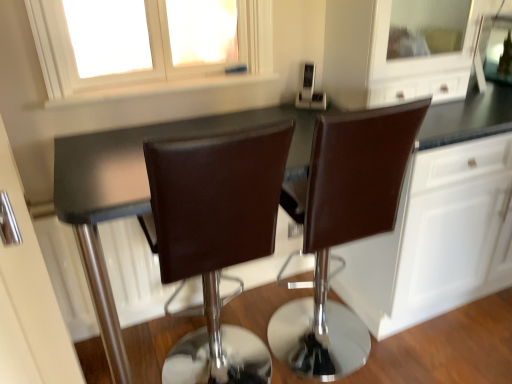
The image size is (512, 384). What do you see at coordinates (433, 239) in the screenshot?
I see `white glossy cabinetry at right` at bounding box center [433, 239].

This screenshot has height=384, width=512. What are the coordinates of `black glossy countertop at center` in the screenshot? It's located at (143, 163).

Image resolution: width=512 pixels, height=384 pixels. Find the location of `white glossy cabinetry at right`. white glossy cabinetry at right is located at coordinates (433, 239).

Who is more distant, brown leather chair at center, which is counted as the first chair, starting from the right, or satin silver toaster at upper center?

satin silver toaster at upper center is further away from the camera.

Is brown leather chair at center, which is counted as the first chair, starting from the right, to the right of satin silver toaster at upper center from the viewer's perspective?

Yes.

Would you say satin silver toaster at upper center is part of brown leather chair at center, which is counted as the first chair, starting from the right,'s contents?

No, satin silver toaster at upper center is located outside of brown leather chair at center, which is counted as the first chair, starting from the right.

Is brown leather chair at center, positioned as the 2th chair in left-to-right order, aimed at satin silver toaster at upper center?

Yes, brown leather chair at center, positioned as the 2th chair in left-to-right order, is facing satin silver toaster at upper center.

Is white matte window at upper center turned away from brown leather chair at center, which is the 1th chair in left-to-right order?

white matte window at upper center does not have its back to brown leather chair at center, which is the 1th chair in left-to-right order.

Considering the relative positions of white matte window at upper center and brown leather chair at center, positioned as the 2th chair in right-to-left order, in the image provided, is white matte window at upper center to the left or to the right of brown leather chair at center, positioned as the 2th chair in right-to-left order,?

white matte window at upper center is to the left of brown leather chair at center, positioned as the 2th chair in right-to-left order.

Considering the points (208, 47) and (183, 204), which point is behind, point (208, 47) or point (183, 204)?

Positioned behind is point (208, 47).

Is white matte window at upper center positioned in front of brown leather chair at center, positioned as the 2th chair in right-to-left order?

No, the depth of white matte window at upper center is greater than that of brown leather chair at center, positioned as the 2th chair in right-to-left order.

Does black glossy countertop at center have a greater width compared to brown leather chair at center, which is the 1th chair in left-to-right order?

Yes, black glossy countertop at center is wider than brown leather chair at center, which is the 1th chair in left-to-right order.

Is black glossy countertop at center turned away from brown leather chair at center, which is the 1th chair in left-to-right order?

Absolutely, black glossy countertop at center is directed away from brown leather chair at center, which is the 1th chair in left-to-right order.

What are the coordinates of `chair below the black glossy countertop at center (from the image's perspective)` in the screenshot? It's located at (216, 237).

From a real-world perspective, which object rests below the other?

black glossy countertop at center.

In the scene shown: In the image, is brown leather chair at center, positioned as the 2th chair in right-to-left order, on the left side or the right side of white glossy cabinetry at right?

Based on their positions, brown leather chair at center, positioned as the 2th chair in right-to-left order, is located to the left of white glossy cabinetry at right.

From a real-world perspective, is brown leather chair at center, positioned as the 2th chair in right-to-left order, positioned above or below white glossy cabinetry at right?

brown leather chair at center, positioned as the 2th chair in right-to-left order, is situated lower than white glossy cabinetry at right in the real world.

Can you confirm if brown leather chair at center, which is the 1th chair in left-to-right order, is shorter than white glossy cabinetry at right?

Yes, brown leather chair at center, which is the 1th chair in left-to-right order, is shorter than white glossy cabinetry at right.

Between black glossy countertop at center and white matte window at upper center, which one has less height?

white matte window at upper center is shorter.

Can you see black glossy countertop at center touching white matte window at upper center?

No, black glossy countertop at center is not with white matte window at upper center.

Is black glossy countertop at center spatially inside white matte window at upper center, or outside of it?

black glossy countertop at center cannot be found inside white matte window at upper center.

Is point (314, 114) less distant than point (70, 54)?

That is False.

From the image's perspective, would you say brown leather chair at center, which is the 1th chair in left-to-right order, is shown under white matte window at upper center?

Yes, from the image's perspective, brown leather chair at center, which is the 1th chair in left-to-right order, is beneath white matte window at upper center.

In order to click on the 1st chair to the right of the white matte window at upper center, starting your count from the anchor in this screenshot , I will do `click(216, 237)`.

Considering the relative positions of brown leather chair at center, which is the 1th chair in left-to-right order, and white matte window at upper center in the image provided, is brown leather chair at center, which is the 1th chair in left-to-right order, to the left of white matte window at upper center from the viewer's perspective?

Incorrect, brown leather chair at center, which is the 1th chair in left-to-right order, is not on the left side of white matte window at upper center.

In the scene shown: Considering the relative sizes of brown leather chair at center, which is the 1th chair in left-to-right order, and white matte window at upper center in the image provided, is brown leather chair at center, which is the 1th chair in left-to-right order, wider than white matte window at upper center?

Yes, brown leather chair at center, which is the 1th chair in left-to-right order, is wider than white matte window at upper center.

What's the angular difference between white glossy cabinetry at right and brown leather chair at center, positioned as the 2th chair in left-to-right order,'s facing directions?

They differ by 178 degrees in their facing directions.

How much distance is there between white glossy cabinetry at right and brown leather chair at center, positioned as the 2th chair in left-to-right order?

white glossy cabinetry at right is 18.03 inches away from brown leather chair at center, positioned as the 2th chair in left-to-right order.

Is white glossy cabinetry at right positioned far away from brown leather chair at center, positioned as the 2th chair in left-to-right order?

white glossy cabinetry at right is actually quite close to brown leather chair at center, positioned as the 2th chair in left-to-right order.

Which point is more distant from viewer, [440,292] or [283,360]?

Point [283,360]

Image resolution: width=512 pixels, height=384 pixels. In the image, there is a brown leather chair at center, which is counted as the first chair, starting from the right. Identify the location of appliance above it (from the image's perspective). (309, 89).

Where is `window located on the left of brown leather chair at center, which is the 1th chair in left-to-right order`? window located on the left of brown leather chair at center, which is the 1th chair in left-to-right order is located at coordinates (148, 46).

Looking at this image, from the image, which object appears to be nearer to satin silver toaster at upper center, brown leather chair at center, which is the 1th chair in left-to-right order, or white glossy cabinetry at right?

brown leather chair at center, which is the 1th chair in left-to-right order.

Looking at the image, which one is located closer to brown leather chair at center, which is counted as the first chair, starting from the right, satin silver toaster at upper center or white matte window at upper center?

satin silver toaster at upper center is positioned closer to the anchor brown leather chair at center, which is counted as the first chair, starting from the right.

Based on their spatial positions, is white matte window at upper center or white glossy cabinetry at right closer to brown leather chair at center, which is the 1th chair in left-to-right order?

Among the two, white matte window at upper center is located nearer to brown leather chair at center, which is the 1th chair in left-to-right order.

Which object lies nearer to the anchor point white glossy cabinetry at right, brown leather chair at center, positioned as the 2th chair in left-to-right order, or black glossy countertop at center?

brown leather chair at center, positioned as the 2th chair in left-to-right order.

When comparing their distances from satin silver toaster at upper center, does black glossy countertop at center or brown leather chair at center, positioned as the 2th chair in right-to-left order, seem closer?

black glossy countertop at center.

When comparing their distances from black glossy countertop at center, does white glossy cabinetry at right or brown leather chair at center, which is counted as the first chair, starting from the right, seem closer?

white glossy cabinetry at right lies closer to black glossy countertop at center than the other object.

Based on the photo, looking at the image, which one is located closer to satin silver toaster at upper center, black glossy countertop at center or white matte window at upper center?

black glossy countertop at center lies closer to satin silver toaster at upper center than the other object.

Considering their positions, is black glossy countertop at center positioned further to white glossy cabinetry at right than white matte window at upper center?

Among the two, white matte window at upper center is located further to white glossy cabinetry at right.

Identify the location of chair between satin silver toaster at upper center and black glossy countertop at center in the up-down direction. The height and width of the screenshot is (384, 512). (344, 230).

Locate an element on the screen. The height and width of the screenshot is (384, 512). chair between brown leather chair at center, positioned as the 2th chair in right-to-left order, and satin silver toaster at upper center in the front-back direction is located at coordinates (344, 230).

Where is `appliance between white matte window at upper center and brown leather chair at center, which is counted as the first chair, starting from the right, vertically`? appliance between white matte window at upper center and brown leather chair at center, which is counted as the first chair, starting from the right, vertically is located at coordinates (309, 89).

This screenshot has width=512, height=384. What are the coordinates of `countertop located between white matte window at upper center and white glossy cabinetry at right in the left-right direction` in the screenshot? It's located at (143, 163).